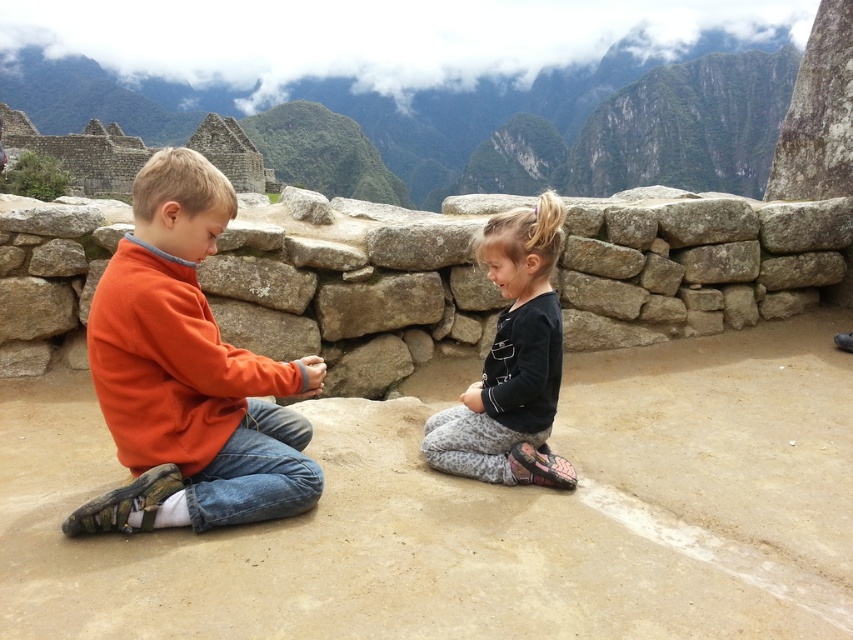
Is rough stone wall at center below orange fleece sweater at left?

No, rough stone wall at center is not below orange fleece sweater at left.

Is point (374, 333) positioned in front of point (242, 451)?

No, it is not.

Identify the location of rough stone wall at center. The image size is (853, 640). tap(351, 284).

Which is behind, point (239, 356) or point (386, 108)?

The point (386, 108) is more distant.

Is orange fleece sweater at left in front of rugged stone wall at upper center?

Yes, orange fleece sweater at left is in front of rugged stone wall at upper center.

What do you see at coordinates (189, 374) in the screenshot? I see `orange fleece sweater at left` at bounding box center [189, 374].

At what (x,y) coordinates should I click in order to perform the action: click on orange fleece sweater at left. Please return your answer as a coordinate pair (x, y). Image resolution: width=853 pixels, height=640 pixels. Looking at the image, I should click on (189, 374).

Does orange fleece sweater at left have a lesser width compared to black matte shirt at center?

Incorrect, orange fleece sweater at left's width is not less than black matte shirt at center's.

Is orange fleece sweater at left bigger than black matte shirt at center?

Correct, orange fleece sweater at left is larger in size than black matte shirt at center.

Is point (184, 248) in front of point (492, 244)?

That is True.

The width and height of the screenshot is (853, 640). Identify the location of orange fleece sweater at left. (189, 374).